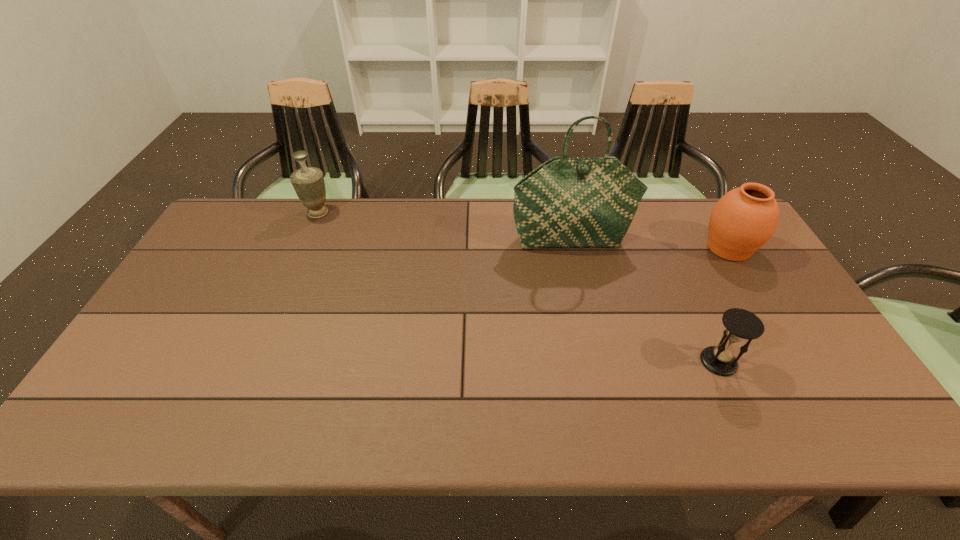
At what (x,y) coordinates should I click in order to perform the action: click on free space that is in between the leftmost object and the nearest object. Please return your answer as a coordinate pair (x, y). The height and width of the screenshot is (540, 960). Looking at the image, I should click on (518, 287).

Find the location of `empty space that is in between the nearest object and the nearer urn`. empty space that is in between the nearest object and the nearer urn is located at coordinates (724, 305).

The height and width of the screenshot is (540, 960). Identify the location of free space that is in between the hourglass and the tallest object. (645, 301).

This screenshot has width=960, height=540. I want to click on free area in between the second object from left to right and the right urn, so click(x=650, y=245).

Find the location of a particular element. The width and height of the screenshot is (960, 540). vacant region between the tote bag and the farther urn is located at coordinates (444, 227).

Locate an element on the screen. free space between the tallest object and the right urn is located at coordinates (650, 245).

This screenshot has width=960, height=540. I want to click on vacant space that's between the shortest object and the rightmost object, so click(724, 305).

The height and width of the screenshot is (540, 960). In order to click on free space between the tallest object and the nearest object in this screenshot , I will do `click(645, 301)`.

I want to click on the closest object relative to the nearest object, so click(744, 219).

Locate which object ranks third in proximity to the shortest object. Please provide its 2D coordinates. Your answer should be formatted as a tuple, i.e. [(x, y)], where the tuple contains the x and y coordinates of a point satisfying the conditions above.

[(308, 182)]